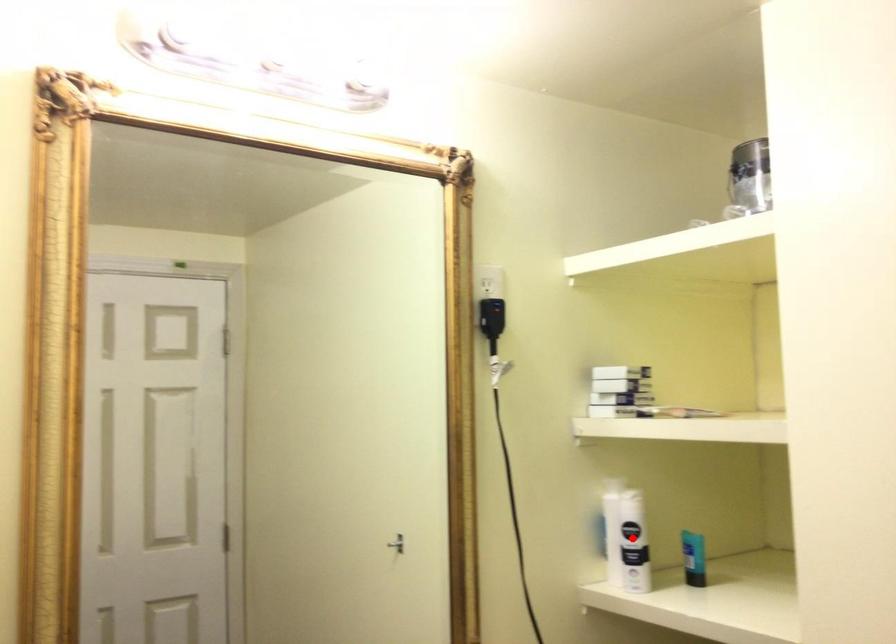
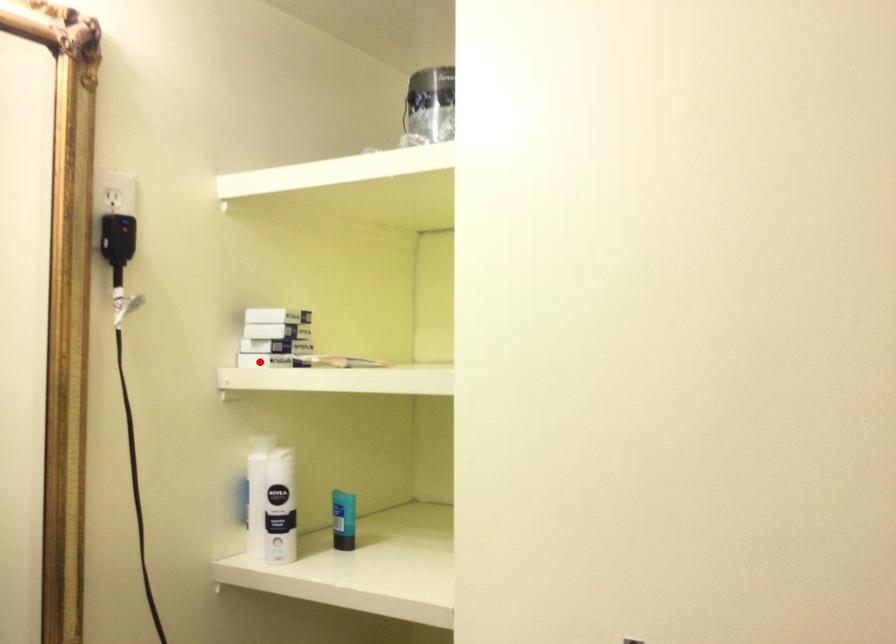
I am providing you with two images of the same scene from different viewpoints. A red point is marked on the first image and another point is marked on the second image. Do the highlighted points in image1 and image2 indicate the same real-world spot?

No